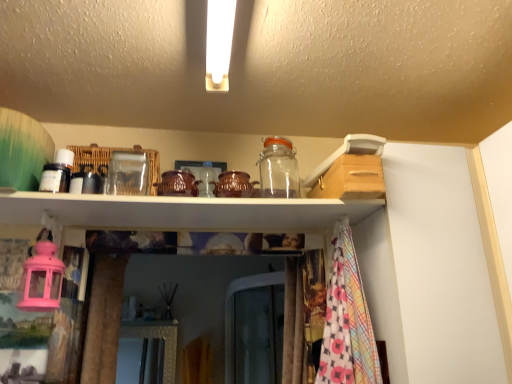
The width and height of the screenshot is (512, 384). What are the coordinates of `white glossy shelf at upper center` in the screenshot? It's located at (182, 212).

Describe the element at coordinates (182, 212) in the screenshot. I see `white glossy shelf at upper center` at that location.

What is the approximate width of white glossy shelf at upper center?

white glossy shelf at upper center is 11.35 inches in width.

What do you see at coordinates (278, 169) in the screenshot?
I see `transparent glass jar at upper center` at bounding box center [278, 169].

Locate an element on the screen. This screenshot has height=384, width=512. transparent glass jar at upper center is located at coordinates (278, 169).

The image size is (512, 384). In order to click on white glossy shelf at upper center in this screenshot , I will do `click(182, 212)`.

Is transparent glass jar at upper center at the left side of white glossy shelf at upper center?

Incorrect, transparent glass jar at upper center is not on the left side of white glossy shelf at upper center.

Which object is more forward, transparent glass jar at upper center or white glossy shelf at upper center?

white glossy shelf at upper center is closer to the camera.

Is point (283, 159) in front of point (179, 208)?

No, (283, 159) is further to viewer.

From the image's perspective, is transparent glass jar at upper center positioned above or below white glossy shelf at upper center?

Based on their image positions, transparent glass jar at upper center is located above white glossy shelf at upper center.

From a real-world perspective, between transparent glass jar at upper center and white glossy shelf at upper center, who is vertically lower?

In real-world perspective, white glossy shelf at upper center is lower.

Does transparent glass jar at upper center have a greater width compared to white glossy shelf at upper center?

No, transparent glass jar at upper center is not wider than white glossy shelf at upper center.

Who is taller, transparent glass jar at upper center or white glossy shelf at upper center?

Standing taller between the two is transparent glass jar at upper center.

Can you confirm if transparent glass jar at upper center is smaller than white glossy shelf at upper center?

Indeed, transparent glass jar at upper center has a smaller size compared to white glossy shelf at upper center.

Could white glossy shelf at upper center be considered to be inside transparent glass jar at upper center?

No, white glossy shelf at upper center is not inside transparent glass jar at upper center.

Is transparent glass jar at upper center beside white glossy shelf at upper center?

transparent glass jar at upper center is not next to white glossy shelf at upper center, and they're not touching.

Could you tell me if transparent glass jar at upper center is turned towards white glossy shelf at upper center?

No, transparent glass jar at upper center is not facing towards white glossy shelf at upper center.

Based on the photo, can you tell me how much transparent glass jar at upper center and white glossy shelf at upper center differ in facing direction?

179 degrees.

The width and height of the screenshot is (512, 384). What are the coordinates of `shelf below the transparent glass jar at upper center (from a real-world perspective)` in the screenshot? It's located at 182,212.

Which object is positioned more to the right, white glossy shelf at upper center or transparent glass jar at upper center?

Positioned to the right is transparent glass jar at upper center.

Is white glossy shelf at upper center in front of or behind transparent glass jar at upper center in the image?

In the image, white glossy shelf at upper center appears in front of transparent glass jar at upper center.

Which is in front, point (234, 229) or point (268, 186)?

The point (234, 229) is closer.

From the image's perspective, is white glossy shelf at upper center above or below transparent glass jar at upper center?

white glossy shelf at upper center is situated lower than transparent glass jar at upper center in the image.

From a real-world perspective, is white glossy shelf at upper center located beneath transparent glass jar at upper center?

Yes.

Considering the sizes of objects white glossy shelf at upper center and transparent glass jar at upper center in the image provided, who is thinner, white glossy shelf at upper center or transparent glass jar at upper center?

Thinner between the two is transparent glass jar at upper center.

Considering the sizes of objects white glossy shelf at upper center and transparent glass jar at upper center in the image provided, who is taller, white glossy shelf at upper center or transparent glass jar at upper center?

transparent glass jar at upper center is taller.

Considering the relative sizes of white glossy shelf at upper center and transparent glass jar at upper center in the image provided, is white glossy shelf at upper center smaller than transparent glass jar at upper center?

No, white glossy shelf at upper center is not smaller than transparent glass jar at upper center.

Is white glossy shelf at upper center positioned beyond the bounds of transparent glass jar at upper center?

That's correct, white glossy shelf at upper center is outside of transparent glass jar at upper center.

Is there a large distance between white glossy shelf at upper center and transparent glass jar at upper center?

→ No, white glossy shelf at upper center is not far from transparent glass jar at upper center.

From the picture: Is white glossy shelf at upper center positioned with its back to transparent glass jar at upper center?

That's not correct — white glossy shelf at upper center is not looking away from transparent glass jar at upper center.

The image size is (512, 384). Find the location of `shelf on the left of transparent glass jar at upper center`. shelf on the left of transparent glass jar at upper center is located at coordinates (182, 212).

Identify the location of glass jar above the white glossy shelf at upper center (from the image's perspective). (278, 169).

Identify the location of glass jar on the right of the white glossy shelf at upper center. (278, 169).